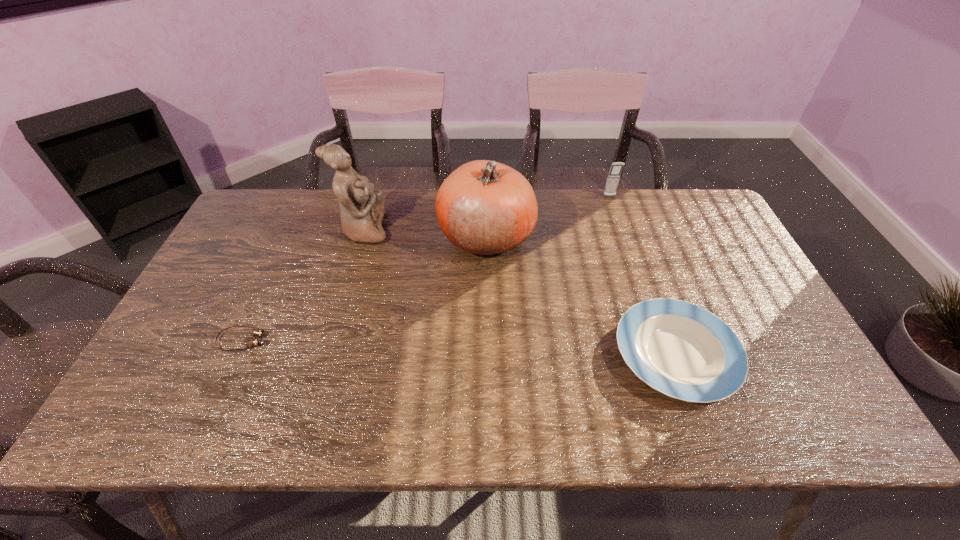
In the image, there is a desktop. Identify the location of free space at the near edge. This screenshot has width=960, height=540. [x=658, y=402].

Locate an element on the screen. The width and height of the screenshot is (960, 540). free space at the left edge of the desktop is located at coordinates (272, 255).

Identify the location of vacant space at the far left corner. This screenshot has height=540, width=960. (299, 193).

The image size is (960, 540). In order to click on free space at the near right corner in this screenshot , I will do `click(830, 411)`.

This screenshot has height=540, width=960. In order to click on free area in between the shortest object and the second object from left to right in this screenshot , I will do `click(303, 285)`.

You are a GUI agent. You are given a task and a screenshot of the screen. Output one action in this format:
    pyautogui.click(x=<x>, y=<y>)
    Task: Click on the empty location between the fourth object from right to left and the shortest object
    The height and width of the screenshot is (540, 960).
    Given the screenshot: What is the action you would take?
    pyautogui.click(x=303, y=285)

I want to click on free space between the farthest object and the goggles, so click(426, 268).

Image resolution: width=960 pixels, height=540 pixels. I want to click on vacant region between the second object from left to right and the third object from right to left, so click(x=425, y=233).

Image resolution: width=960 pixels, height=540 pixels. What are the coordinates of `free point between the cellular telephone and the fourth tallest object` in the screenshot? It's located at (643, 275).

What are the coordinates of `free space that is in between the farthest object and the pumpkin` in the screenshot? It's located at (548, 216).